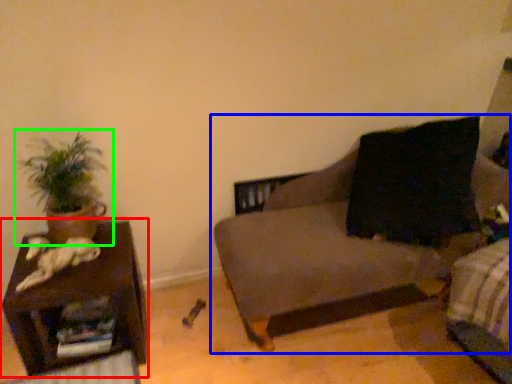
Question: Which is farther away from furniture (highlighted by a red box)? studio couch (highlighted by a blue box) or houseplant (highlighted by a green box)?

Choices:
 (A) studio couch
 (B) houseplant

Answer: (A)